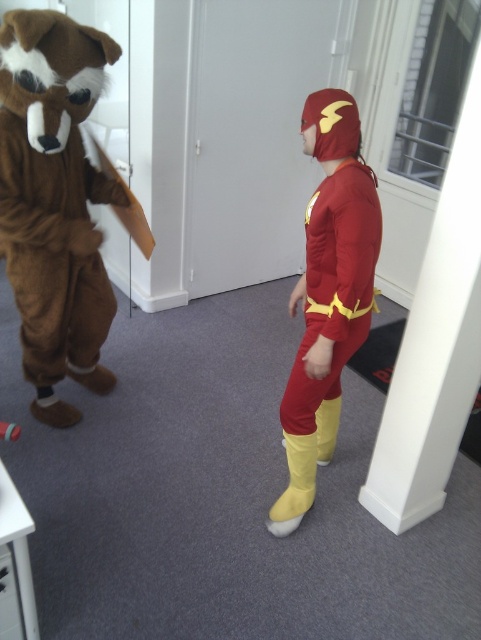
Who is more distant from viewer, (61,250) or (326,154)?

The point (61,250) is more distant.

Can you confirm if brown furry costume at left is positioned above shiny red fabric superhero suit at center?

Yes.

Who is more forward, (11, 74) or (287, 433)?

Point (11, 74)

Locate an element on the screen. This screenshot has width=481, height=640. brown furry costume at left is located at coordinates (53, 202).